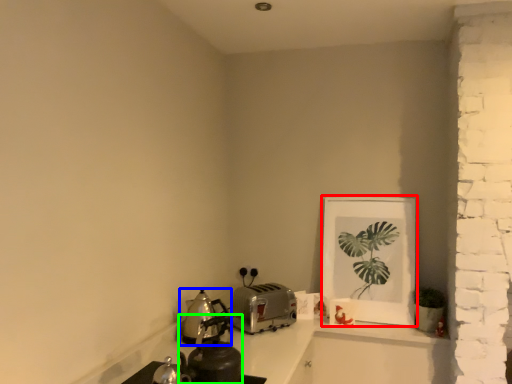
Question: Which is nearer to the picture frame (highlighted by a red box)? kitchen appliance (highlighted by a blue box) or tea pot (highlighted by a green box).

Choices:
 (A) kitchen appliance
 (B) tea pot

Answer: (A)